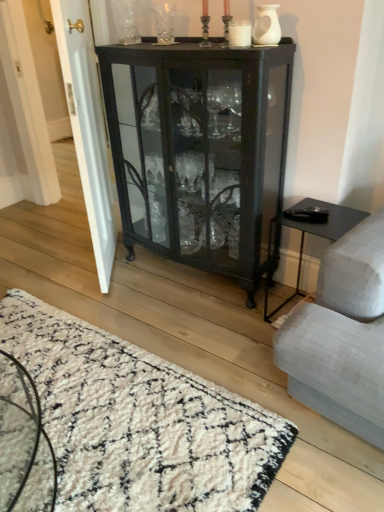
In order to face clear glass vase at upper center, the 2th glass vase viewed from the right, should I rotate leftwards or rightwards?

You should look left and rotate roughly 8.711 degrees.

This screenshot has width=384, height=512. What do you see at coordinates (266, 26) in the screenshot?
I see `white matte vase at upper center, which is the first glass vase in front-to-back order` at bounding box center [266, 26].

Identify the location of clear glass vase at upper center, the 1th glass vase in the top-to-bottom sequence. Image resolution: width=384 pixels, height=512 pixels. (126, 21).

Is clear glass vase at upper center, which ranks as the 1th glass vase in left-to-right order, behind black glass cabinet at center?

Yes.

In the image, there is a clear glass vase at upper center, arranged as the second glass vase when ordered from the bottom. Where is `cupboard below it (from a real-world perspective)`? cupboard below it (from a real-world perspective) is located at coordinates (200, 151).

From a real-world perspective, is clear glass vase at upper center, the 1th glass vase in the top-to-bottom sequence, physically located above or below black glass cabinet at center?

Clearly, from a real-world perspective, clear glass vase at upper center, the 1th glass vase in the top-to-bottom sequence, is above black glass cabinet at center.

From the image's perspective, which one is positioned lower, clear glass vase at upper center, the 1th glass vase in the top-to-bottom sequence, or black glass cabinet at center?

black glass cabinet at center is shown below in the image.

Between white shaggy rug at lower left and black glass cabinet at center, which one appears on the left side from the viewer's perspective?

Positioned to the left is white shaggy rug at lower left.

Which of these two, white shaggy rug at lower left or black glass cabinet at center, is thinner?

black glass cabinet at center is thinner.

Identify the location of cupboard that is above the white shaggy rug at lower left (from the image's perspective). (200, 151).

From a real-world perspective, is white shaggy rug at lower left on black glass cabinet at center?

Actually, white shaggy rug at lower left is physically below black glass cabinet at center in the real world.

In the image, is white glossy door at left on the left side or the right side of clear glass vase at upper center, which ranks as the 1th glass vase in left-to-right order?

white glossy door at left is to the left of clear glass vase at upper center, which ranks as the 1th glass vase in left-to-right order.

Does white glossy door at left have a larger size compared to clear glass vase at upper center, which ranks as the 1th glass vase in left-to-right order?

Correct, white glossy door at left is larger in size than clear glass vase at upper center, which ranks as the 1th glass vase in left-to-right order.

I want to click on screen door in front of the clear glass vase at upper center, arranged as the first glass vase when viewed from the back, so click(87, 127).

How many degrees apart are the facing directions of white glossy door at left and clear glass vase at upper center, the 1th glass vase in the top-to-bottom sequence?

The angular difference between white glossy door at left and clear glass vase at upper center, the 1th glass vase in the top-to-bottom sequence, is 47.5 degrees.

Choose the correct answer: Is clear glass vase at upper center, the 2th glass vase viewed from the right, inside white glossy door at left or outside it?

The correct answer is: outside.

Considering the sizes of objects clear glass vase at upper center, placed as the second glass vase when sorted from front to back, and white glossy door at left in the image provided, who is wider, clear glass vase at upper center, placed as the second glass vase when sorted from front to back, or white glossy door at left?

With larger width is white glossy door at left.

Is the position of clear glass vase at upper center, the 1th glass vase in the top-to-bottom sequence, less distant than that of white glossy door at left?

No.

Is clear glass vase at upper center, arranged as the second glass vase when ordered from the bottom, placed right next to white glossy door at left?

clear glass vase at upper center, arranged as the second glass vase when ordered from the bottom, and white glossy door at left are clearly separated.

What's the angular difference between white matte vase at upper center, the second glass vase in the left-to-right sequence, and black glass cabinet at center's facing directions?

They differ by 4.18 degrees in their facing directions.

Is white matte vase at upper center, which is the first glass vase in bottom-to-top order, positioned far away from black glass cabinet at center?

No, there isn't a large distance between white matte vase at upper center, which is the first glass vase in bottom-to-top order, and black glass cabinet at center.

The width and height of the screenshot is (384, 512). Identify the location of cupboard below the white matte vase at upper center, which is the first glass vase in bottom-to-top order (from a real-world perspective). (200, 151).

Looking at this image, can you confirm if white matte vase at upper center, which is the first glass vase in bottom-to-top order, is smaller than black glass cabinet at center?

Yes.

Consider the image. From the image's perspective, would you say black glass cabinet at center is positioned over white shaggy rug at lower left?

Correct, black glass cabinet at center appears higher than white shaggy rug at lower left in the image.

From a real-world perspective, who is located higher, black glass cabinet at center or white shaggy rug at lower left?

black glass cabinet at center.

Between black glass cabinet at center and white shaggy rug at lower left, which one has smaller size?

white shaggy rug at lower left is smaller.

Is white glossy door at left directly adjacent to white matte vase at upper center, which is the first glass vase in bottom-to-top order?

white glossy door at left and white matte vase at upper center, which is the first glass vase in bottom-to-top order, are not in contact.

Looking at this image, considering the relative sizes of white glossy door at left and white matte vase at upper center, acting as the 2th glass vase starting from the top, in the image provided, is white glossy door at left shorter than white matte vase at upper center, acting as the 2th glass vase starting from the top,?

No.

Which is behind, white glossy door at left or white matte vase at upper center, acting as the 2th glass vase starting from the top?

Positioned behind is white glossy door at left.

From the image's perspective, which object appears higher, white glossy door at left or white matte vase at upper center, placed as the second glass vase when sorted from back to front?

white matte vase at upper center, placed as the second glass vase when sorted from back to front, from the image's perspective.

Where is `cupboard that is in front of the clear glass vase at upper center, placed as the second glass vase when sorted from front to back`? The height and width of the screenshot is (512, 384). cupboard that is in front of the clear glass vase at upper center, placed as the second glass vase when sorted from front to back is located at coordinates (200, 151).

The height and width of the screenshot is (512, 384). Find the location of `cupboard that is behind the white shaggy rug at lower left`. cupboard that is behind the white shaggy rug at lower left is located at coordinates (200, 151).

Estimate the real-world distances between objects in this image. Which object is closer to white matte vase at upper center, placed as the second glass vase when sorted from back to front, white shaggy rug at lower left or clear glass vase at upper center, the 1th glass vase in the top-to-bottom sequence?

Based on the image, clear glass vase at upper center, the 1th glass vase in the top-to-bottom sequence, appears to be nearer to white matte vase at upper center, placed as the second glass vase when sorted from back to front.

When comparing their distances from white matte vase at upper center, the second glass vase in the left-to-right sequence, does clear glass vase at upper center, which ranks as the 1th glass vase in left-to-right order, or white shaggy rug at lower left seem closer?

clear glass vase at upper center, which ranks as the 1th glass vase in left-to-right order, is positioned closer to the anchor white matte vase at upper center, the second glass vase in the left-to-right sequence.

Based on their spatial positions, is black glass cabinet at center or white glossy door at left further from white shaggy rug at lower left?

The object further to white shaggy rug at lower left is black glass cabinet at center.

Looking at the image, which one is located closer to clear glass vase at upper center, the 1th glass vase in the top-to-bottom sequence, white glossy door at left or white shaggy rug at lower left?

white glossy door at left is positioned closer to the anchor clear glass vase at upper center, the 1th glass vase in the top-to-bottom sequence.

Looking at the image, which one is located closer to black glass cabinet at center, white glossy door at left or white matte vase at upper center, placed as the second glass vase when sorted from back to front?

Based on the image, white glossy door at left appears to be nearer to black glass cabinet at center.

In the scene shown: Looking at the image, which one is located closer to white glossy door at left, white shaggy rug at lower left or black glass cabinet at center?

black glass cabinet at center is closer to white glossy door at left.

From the image, which object appears to be nearer to white glossy door at left, clear glass vase at upper center, placed as the second glass vase when sorted from front to back, or white shaggy rug at lower left?

clear glass vase at upper center, placed as the second glass vase when sorted from front to back.

Estimate the real-world distances between objects in this image. Which object is further from black glass cabinet at center, white glossy door at left or clear glass vase at upper center, the 2th glass vase viewed from the right?

Among the two, clear glass vase at upper center, the 2th glass vase viewed from the right, is located further to black glass cabinet at center.

Identify the location of glass vase between white glossy door at left and white matte vase at upper center, the second glass vase in the left-to-right sequence, from left to right. The height and width of the screenshot is (512, 384). (126, 21).

Where is `cupboard situated between white glossy door at left and white matte vase at upper center, acting as the 2th glass vase starting from the top, from left to right`? The image size is (384, 512). cupboard situated between white glossy door at left and white matte vase at upper center, acting as the 2th glass vase starting from the top, from left to right is located at coordinates (200, 151).

Locate an element on the screen. glass vase between clear glass vase at upper center, placed as the second glass vase when sorted from front to back, and black glass cabinet at center, in the vertical direction is located at coordinates (266, 26).

Identify the location of screen door between clear glass vase at upper center, arranged as the second glass vase when ordered from the bottom, and white shaggy rug at lower left vertically. (x=87, y=127).